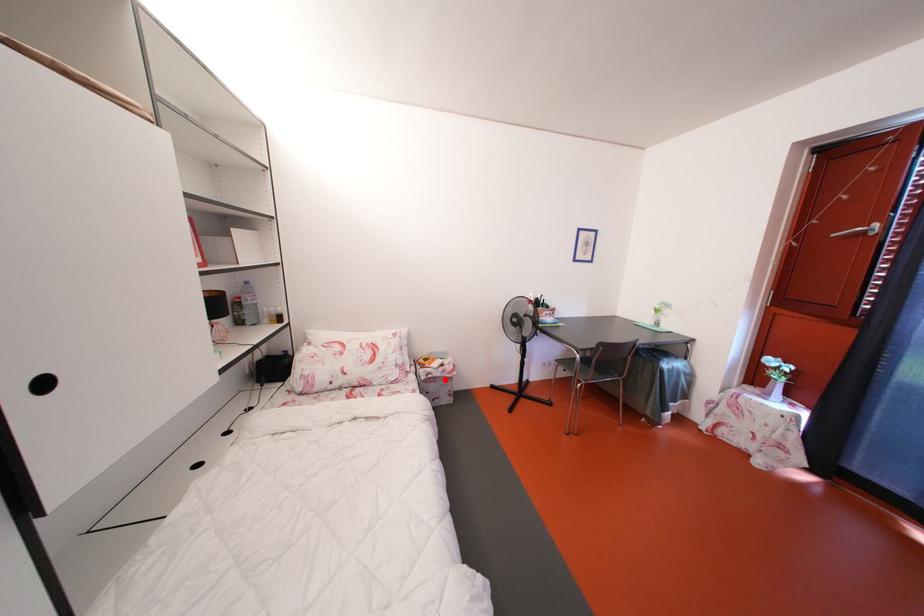
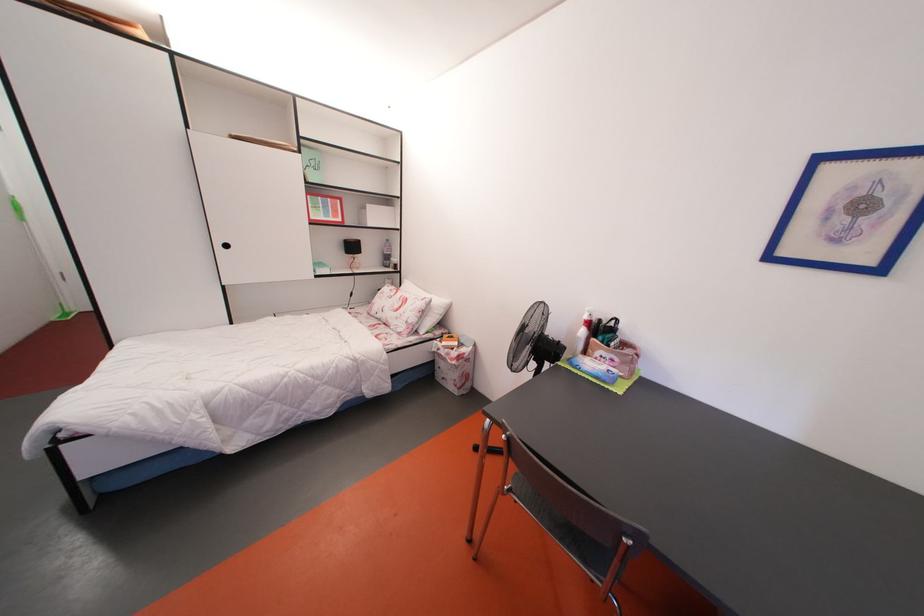
The point at the highlighted location is marked in the first image. Where is the corresponding point in the second image?

(450, 360)